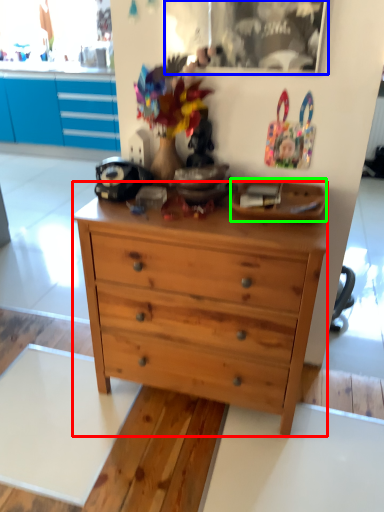
Question: Considering the real-world distances, which object is closest to chest of drawers (highlighted by a red box)? picture frame (highlighted by a blue box) or plate (highlighted by a green box).

Choices:
 (A) picture frame
 (B) plate

Answer: (B)